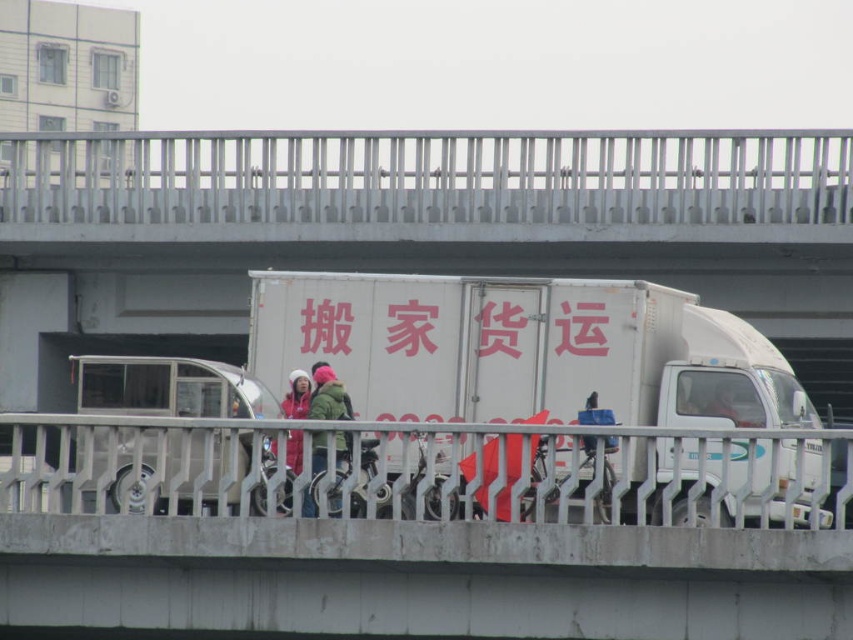
You are standing on the bridge and want to move from point A to point B. Point A is at coordinate point A, which is point (282, 339), and point B is at coordinate point B, which is point (345, 413). Which point is closer to you when you are facing the bridge?

Point A at coordinate point (282, 339) is closer to you because it is further to the viewer than point B at coordinate point (345, 413).

You are a pedestrian standing on the bridge and see both the green fuzzy jacket at center and the red matte jacket at center. Which jacket is positioned to the right side from your viewpoint?

The green fuzzy jacket at center is positioned to the right of the red matte jacket at center, so the green fuzzy jacket at center is on the right side from your viewpoint.

You are a delivery driver who needs to ensure your white matte truck at center can pass under the white metal railing at upper center without hitting it. Based on the scene, can you safely drive the truck under the railing?

The white metal railing at upper center is smaller than the white matte truck at center, so the truck can safely pass under the railing without hitting it.